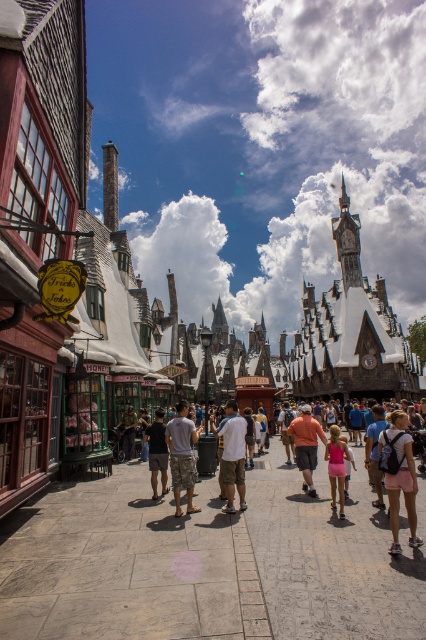
You are a wizard attending a magical event in Diagon Alley. You notice two attendees wearing a white cotton shirt at center and a pink fabric dress at center. Which clothing item is closer to you?

The white cotton shirt at center is closer to you because the pink fabric dress at center is positioned behind it.

You are a wizard attending a magical event and need to quickly move from your current position to the entrance of the nearby Honeydukes shop. You notice a white cotton shirt at center and a pink fabric dress at center in your path. Given that you can only move in a straight line and must avoid both obstacles, which direction should you choose to ensure you don not collide with either?

To avoid both the white cotton shirt at center and the pink fabric dress at center, you should move in a direction that is not directly towards either obstacle. Since they are 14.48 meters apart, there is sufficient space to navigate around them by choosing a path that steers clear of both objects.